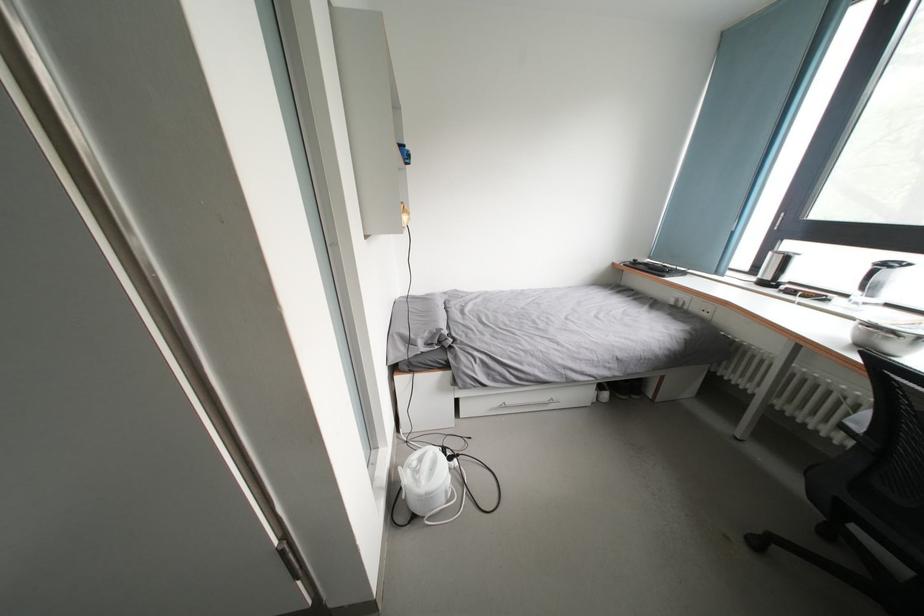
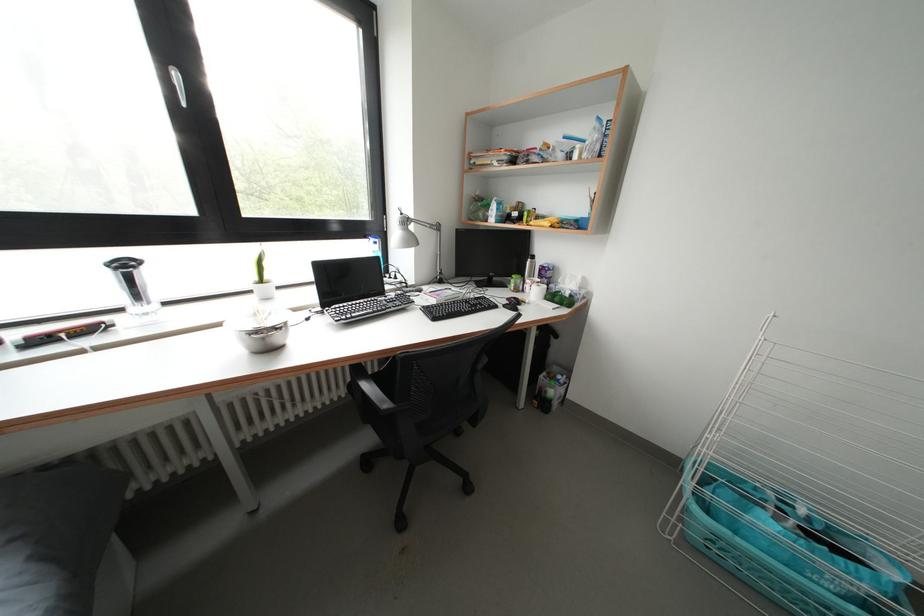
Locate, in the second image, the point that corresponds to point (893, 270) in the first image.

(131, 270)